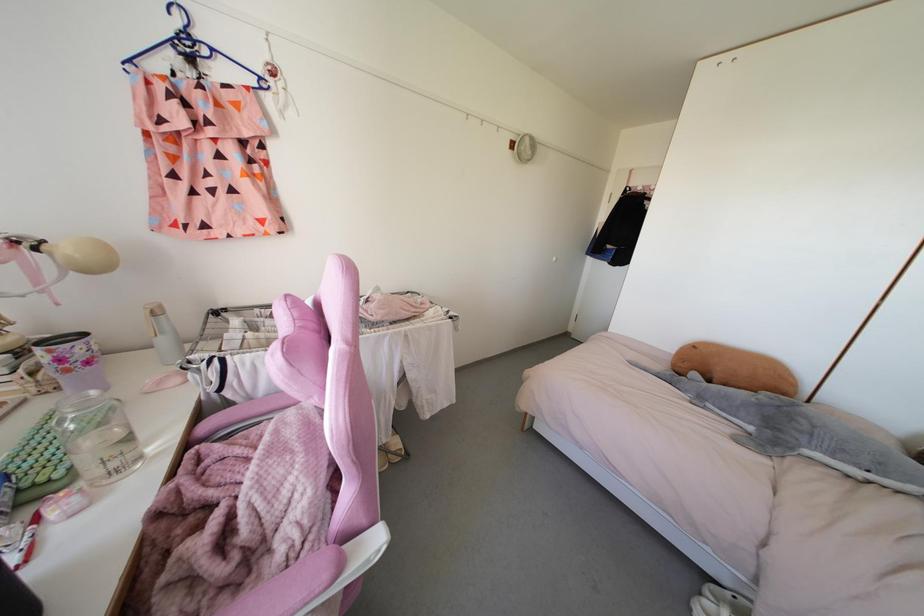
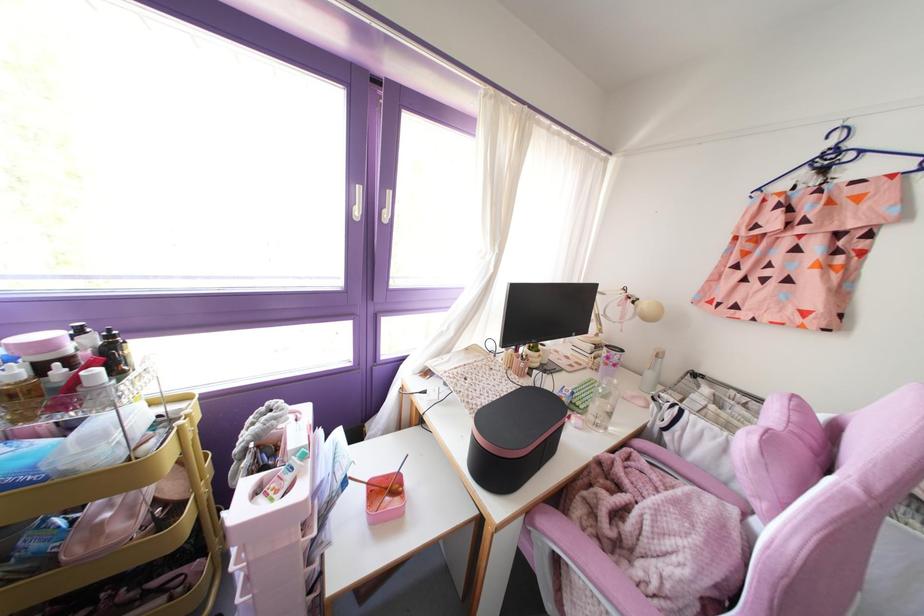
Locate, in the second image, the point that corresponds to pixel 88 362 in the first image.

(614, 365)